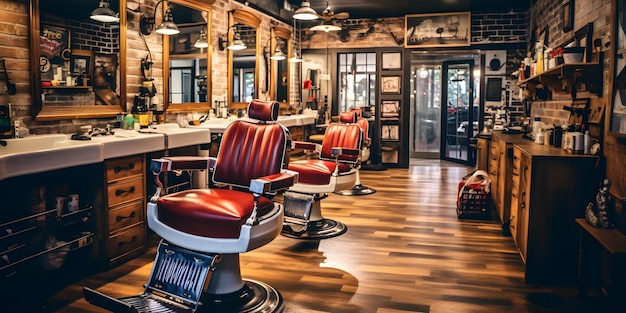
Identify the location of door. (429, 156), (456, 146).